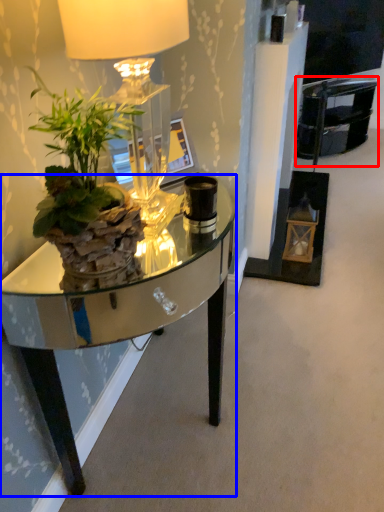
Question: Which of the following is the closest to the observer, armchair (highlighted by a red box) or desk (highlighted by a blue box)?

Choices:
 (A) armchair
 (B) desk

Answer: (B)